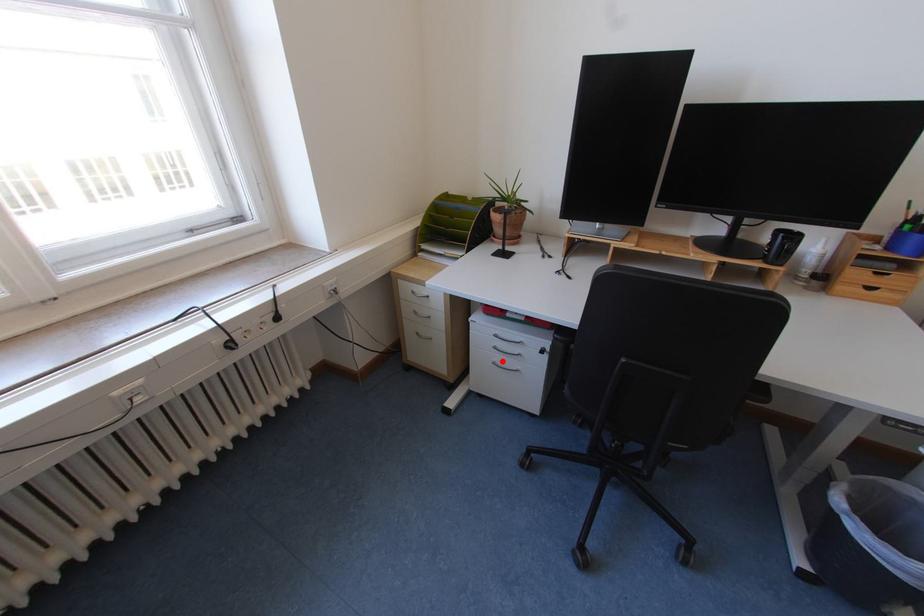
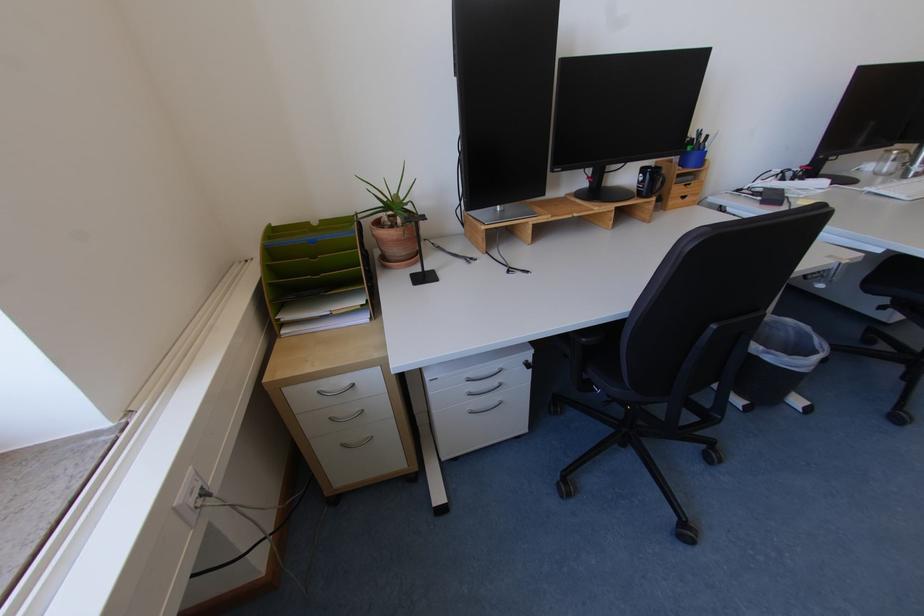
Locate, in the second image, the point that corresponds to the highlighted location in the first image.

(477, 410)